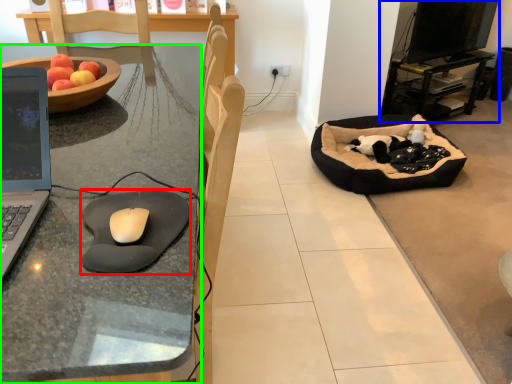
Question: Estimate the real-world distances between objects in this image. Which object is closer to mousepad (highlighted by a red box), entertainment center (highlighted by a blue box) or desk (highlighted by a green box)?

Choices:
 (A) entertainment center
 (B) desk

Answer: (B)